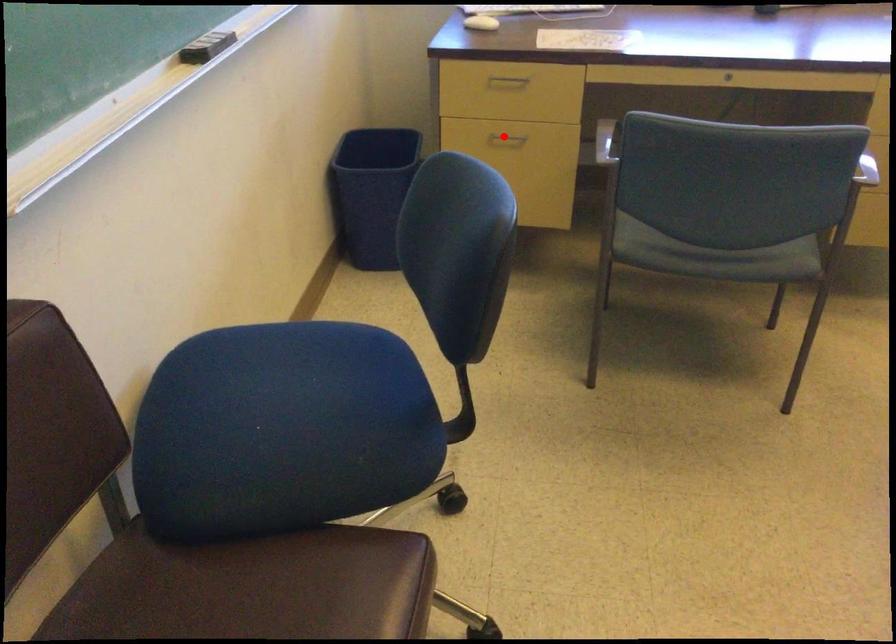
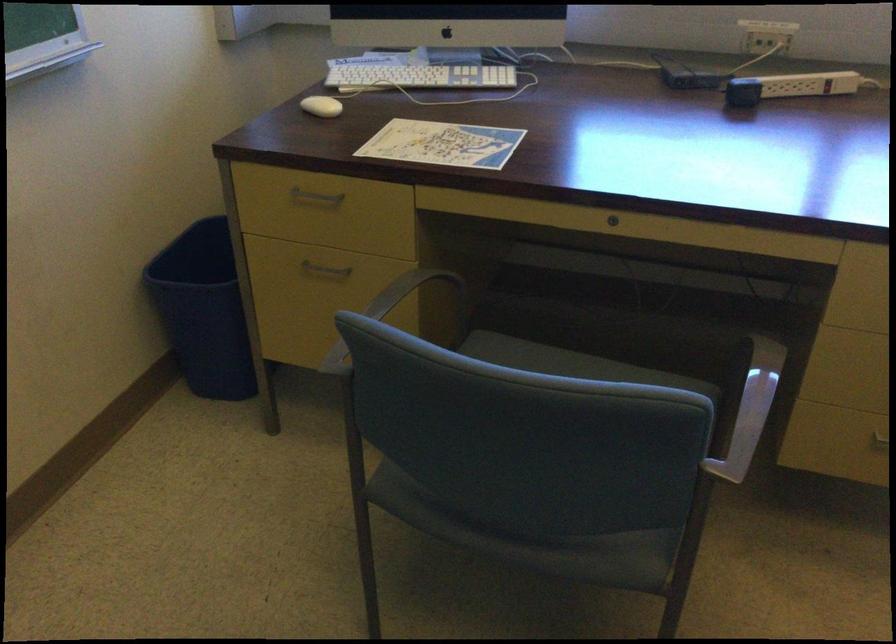
Question: I am providing you with two images of the same scene from different viewpoints. Given a red point in image1, look at the same physical point in image2. Is it:

Choices:
 (A) Closer to the viewpoint
 (B) Farther from the viewpoint

Answer: (A)